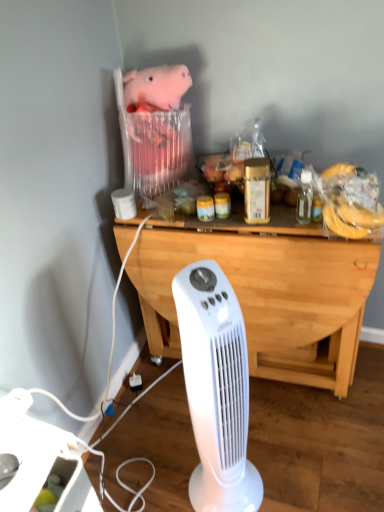
Locate an element on the screen. Image resolution: width=384 pixels, height=512 pixels. free space to the left of white plastic fan at center is located at coordinates (159, 476).